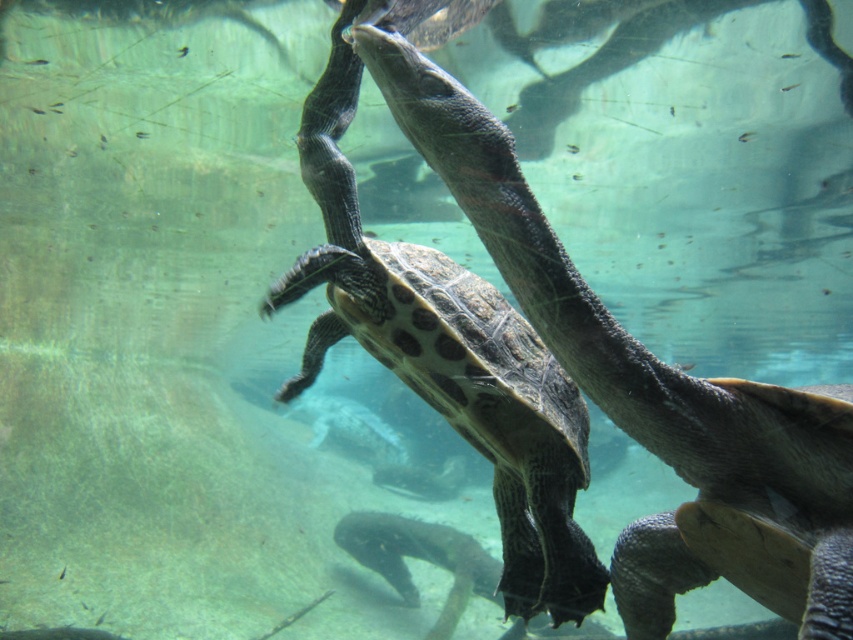
Question: Does leathery greenish-brown tortoise at center have a smaller size compared to leathery green tortoise at center?

Choices:
 (A) no
 (B) yes

Answer: (B)

Question: Which of the following is the closest to the observer?

Choices:
 (A) (572, 353)
 (B) (317, 157)

Answer: (A)

Question: Can you confirm if leathery greenish-brown tortoise at center is positioned to the left of leathery green tortoise at center?

Choices:
 (A) yes
 (B) no

Answer: (B)

Question: Is leathery greenish-brown tortoise at center positioned before leathery green tortoise at center?

Choices:
 (A) no
 (B) yes

Answer: (B)